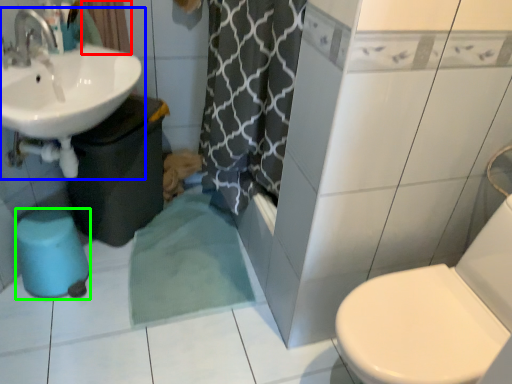
Question: Which is nearer to the curtain (highlighted by a red box)? sink (highlighted by a blue box) or bidet (highlighted by a green box).

Choices:
 (A) sink
 (B) bidet

Answer: (A)